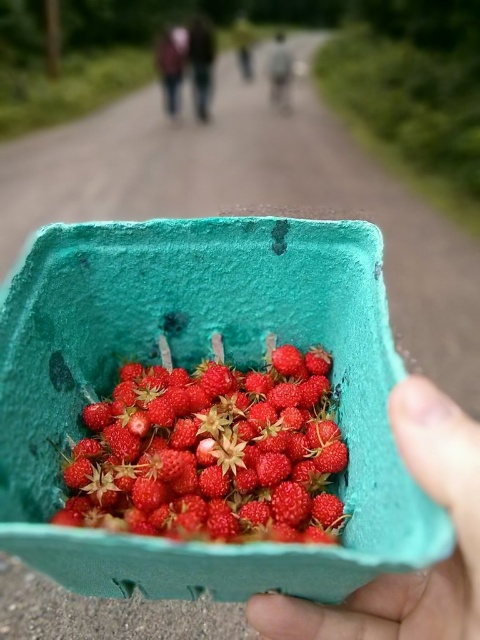
Question: Considering the relative positions of shiny red berries at center and green foam tray at lower right in the image provided, where is shiny red berries at center located with respect to green foam tray at lower right?

Choices:
 (A) left
 (B) right

Answer: (A)

Question: Which point is farther to the camera?

Choices:
 (A) (191, 36)
 (B) (162, 67)
 (C) (330, 554)

Answer: (B)

Question: Does green foam tray at center appear under green textured jacket at upper center?

Choices:
 (A) yes
 (B) no

Answer: (A)

Question: Does green foam basket at center have a lesser width compared to gray fabric jacket at center?

Choices:
 (A) no
 (B) yes

Answer: (A)

Question: Which point is farther to the camera?

Choices:
 (A) (188, 58)
 (B) (386, 284)
 (C) (245, 20)

Answer: (C)

Question: Among these objects, which one is farthest from the camera?

Choices:
 (A) green textured jacket at upper center
 (B) brown leather jacket at upper center
 (C) shiny red berries at center

Answer: (A)